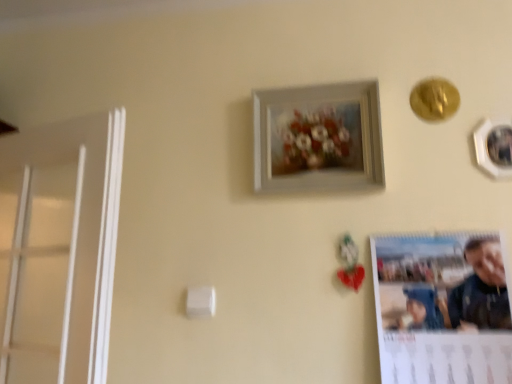
Question: In which direction should I rotate to look at white matte picture frame at upper center, the first picture frame in the left-to-right sequence?

Choices:
 (A) left
 (B) right

Answer: (B)

Question: Does matte paper calendar at lower right have a lesser height compared to white matte picture frame at upper center, the first picture frame in the left-to-right sequence?

Choices:
 (A) no
 (B) yes

Answer: (A)

Question: Is matte paper calendar at lower right aimed at white matte picture frame at upper center, acting as the 2th picture frame starting from the right?

Choices:
 (A) no
 (B) yes

Answer: (A)

Question: Can you confirm if matte paper calendar at lower right is positioned to the right of white matte picture frame at upper center, the first picture frame in the left-to-right sequence?

Choices:
 (A) yes
 (B) no

Answer: (A)

Question: From the image's perspective, is matte paper calendar at lower right located beneath white matte picture frame at upper center, the first picture frame in the left-to-right sequence?

Choices:
 (A) no
 (B) yes

Answer: (B)

Question: Is matte paper calendar at lower right surrounding white matte picture frame at upper center, the first picture frame in the left-to-right sequence?

Choices:
 (A) yes
 (B) no

Answer: (B)

Question: Is matte paper calendar at lower right outside white matte picture frame at upper center, acting as the 2th picture frame starting from the right?

Choices:
 (A) no
 (B) yes

Answer: (B)

Question: From a real-world perspective, is white glossy picture frame at upper right, the 2th picture frame from the left, beneath white matte picture frame at upper center, the first picture frame in the left-to-right sequence?

Choices:
 (A) no
 (B) yes

Answer: (B)

Question: Is white glossy picture frame at upper right, placed as the first picture frame when sorted from right to left, closer to camera compared to white matte picture frame at upper center, acting as the 2th picture frame starting from the right?

Choices:
 (A) yes
 (B) no

Answer: (A)

Question: Is white glossy picture frame at upper right, the 2th picture frame from the left, next to white matte picture frame at upper center, acting as the 2th picture frame starting from the right?

Choices:
 (A) no
 (B) yes

Answer: (A)

Question: Is white glossy picture frame at upper right, placed as the first picture frame when sorted from right to left, bigger than white matte picture frame at upper center, acting as the 2th picture frame starting from the right?

Choices:
 (A) yes
 (B) no

Answer: (B)

Question: Is white glossy picture frame at upper right, placed as the first picture frame when sorted from right to left, not inside white matte picture frame at upper center, the first picture frame in the left-to-right sequence?

Choices:
 (A) yes
 (B) no

Answer: (A)

Question: From a real-world perspective, is white glossy picture frame at upper right, placed as the first picture frame when sorted from right to left, physically above white matte picture frame at upper center, acting as the 2th picture frame starting from the right?

Choices:
 (A) yes
 (B) no

Answer: (B)

Question: Can you confirm if white matte picture frame at upper center, the first picture frame in the left-to-right sequence, is bigger than matte paper calendar at lower right?

Choices:
 (A) no
 (B) yes

Answer: (A)